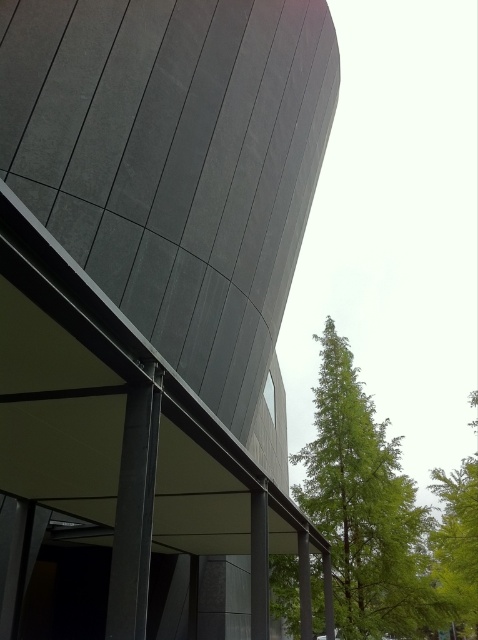
Can you confirm if green leafy tree at right is taller than green leafy tree at upper right?

In fact, green leafy tree at right may be shorter than green leafy tree at upper right.

Which is below, green leafy tree at right or green leafy tree at upper right?

green leafy tree at upper right is below.

Find the location of a particular element. Image resolution: width=478 pixels, height=640 pixels. green leafy tree at right is located at coordinates (365, 508).

Identify the location of green leafy tree at right. This screenshot has width=478, height=640. (365, 508).

Looking at this image, is matte gray building at center shorter than green leafy tree at right?

Incorrect, matte gray building at center's height does not fall short of green leafy tree at right's.

Is point (104, 529) positioned in front of point (337, 400)?

Yes, point (104, 529) is closer to viewer.

You are a GUI agent. You are given a task and a screenshot of the screen. Output one action in this format:
    pyautogui.click(x=<x>, y=<y>)
    Task: Click on the matte gray building at center
    This screenshot has width=478, height=640.
    Given the screenshot: What is the action you would take?
    pyautogui.click(x=152, y=307)

Is matte gray building at center to the right of green leafy tree at upper right from the viewer's perspective?

Incorrect, matte gray building at center is not on the right side of green leafy tree at upper right.

Is matte gray building at center bigger than green leafy tree at upper right?

No.

In order to click on matte gray building at center in this screenshot , I will do 152,307.

You are a GUI agent. You are given a task and a screenshot of the screen. Output one action in this format:
    pyautogui.click(x=<x>, y=<y>)
    Task: Click on the matte gray building at center
    Image resolution: width=478 pixels, height=640 pixels.
    Given the screenshot: What is the action you would take?
    pyautogui.click(x=152, y=307)